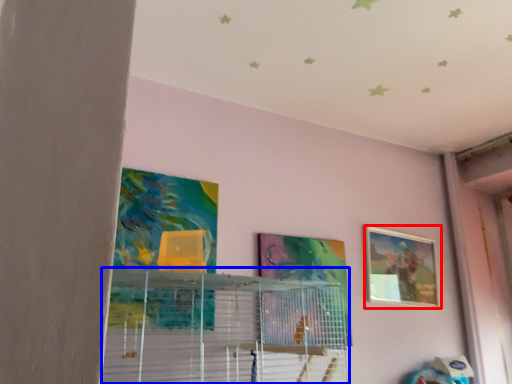
Question: Which of the following is the farthest to the observer, picture frame (highlighted by a red box) or shelf (highlighted by a blue box)?

Choices:
 (A) picture frame
 (B) shelf

Answer: (A)